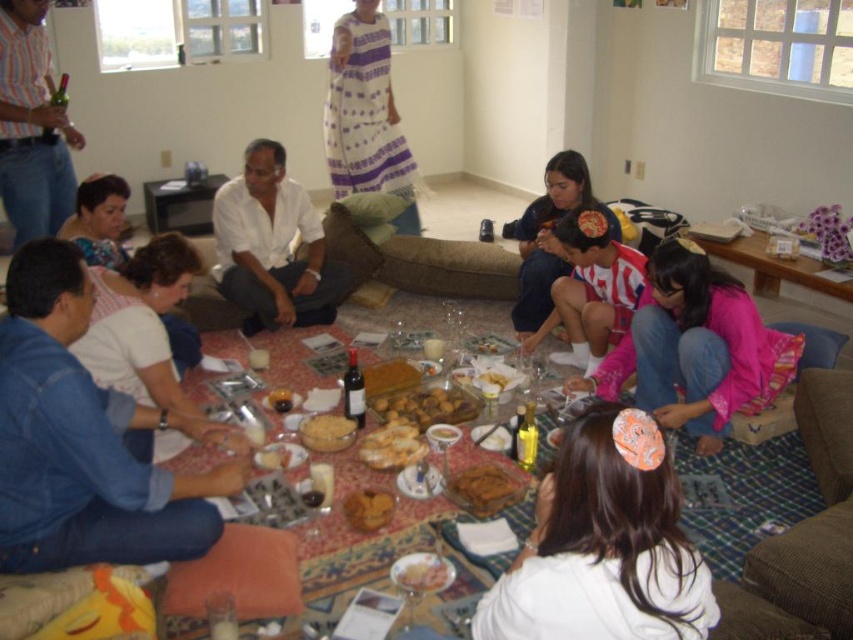
Question: Which of these objects is positioned farthest from the golden brown doughnut at center?

Choices:
 (A) golden crispy cookie at center
 (B) golden crispy pastry at center
 (C) golden brown crumbly bread at center

Answer: (A)

Question: Does white fabric hair clip at lower center have a smaller size compared to white matte shirt at center?

Choices:
 (A) no
 (B) yes

Answer: (B)

Question: Among these objects, which one is nearest to the camera?

Choices:
 (A) striped cotton shirt at upper left
 (B) golden brown crumbly bread at center
 (C) white crumbly bread at center

Answer: (B)

Question: Is striped cotton shirt at upper left smaller than golden crispy cookie at center?

Choices:
 (A) yes
 (B) no

Answer: (B)

Question: Which of the following is the farthest from the observer?

Choices:
 (A) golden crispy pastry at center
 (B) smooth yellow cheese at center
 (C) matte glass table at center

Answer: (A)

Question: Is golden brown crumbly bread at center wider than smooth brown bread at center?

Choices:
 (A) yes
 (B) no

Answer: (A)